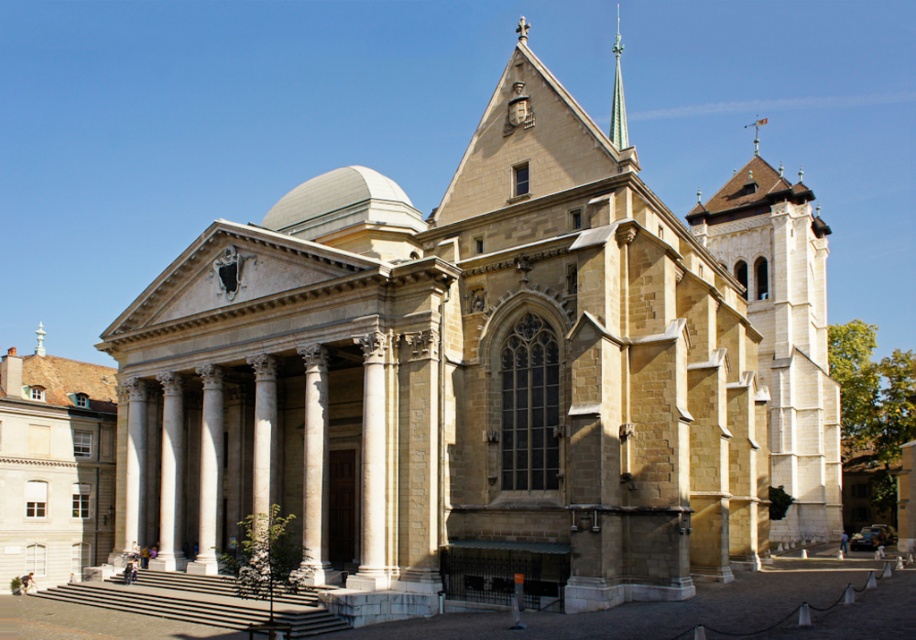
Based on the photo, you are standing in front of the grand architectural structure described. You notice two points marked on the building. The first point is at coordinate point (x=15, y=474) and the second is at point (x=614, y=48). From your vantage point, which point appears closer to you?

Point (x=15, y=474) is in front of point (x=614, y=48), so it appears closer to you.

You are an architect visiting this building and want to determine the relative sizes of the beige stone church at center and the green glass spire at upper center. Based on the image, which one appears larger?

The beige stone church at center is smaller than the green glass spire at upper center, so the green glass spire at upper center appears larger.

Based on the photo, you are an architect visiting this historical site. You notice the beige stone church at center and the green glass spire at upper center. Which structure is taller?

The green glass spire at upper center is taller than the beige stone church at center.